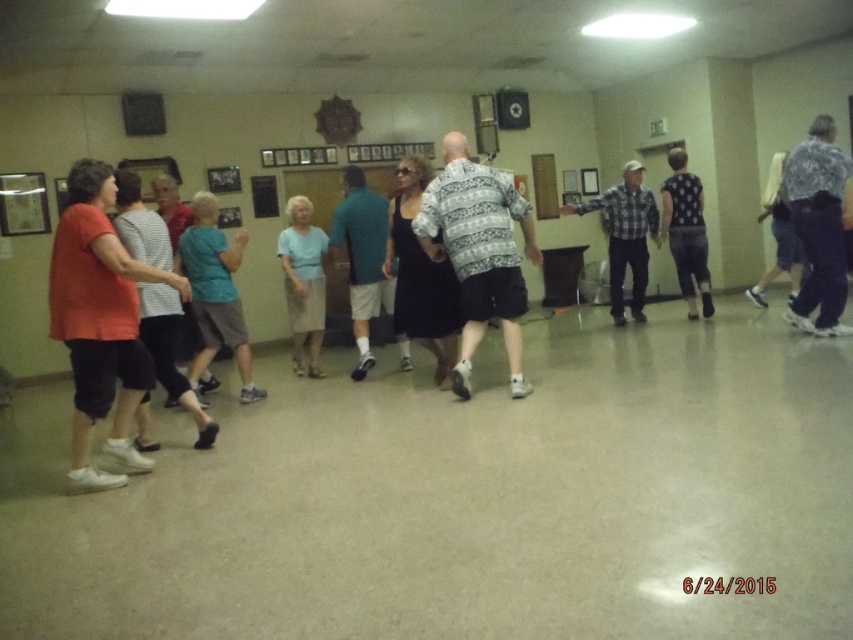
Where is the patterned shirt at center located in the image?

The patterned shirt at center is located at point (479, 253).

You are standing in the community center and want to move from the point at coordinates (91, 221) to the point at coordinates (688, 273). Which direction should you move in relation to the room?

You should move backward because point (91, 221) is in front of point (688, 273), so moving backward will take you toward the latter point.